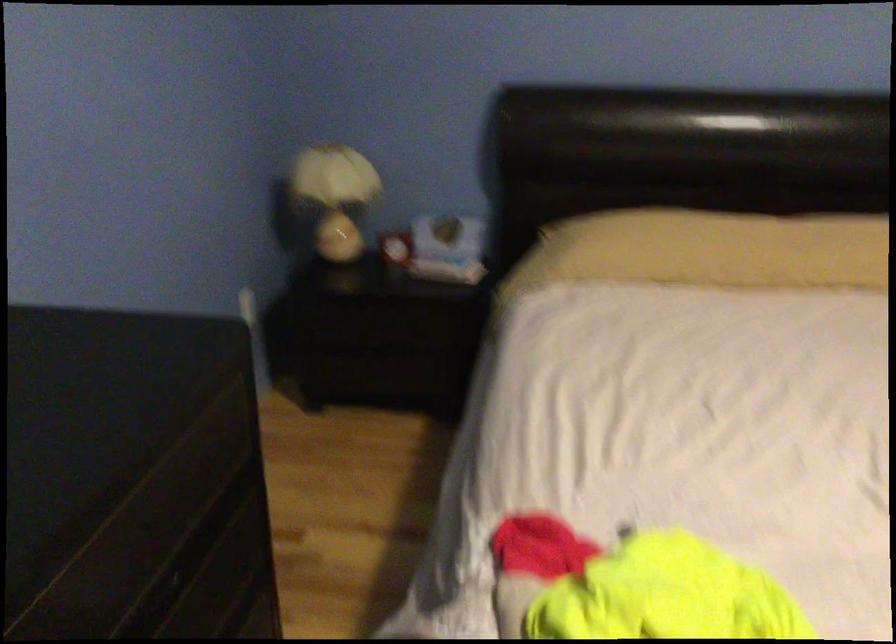
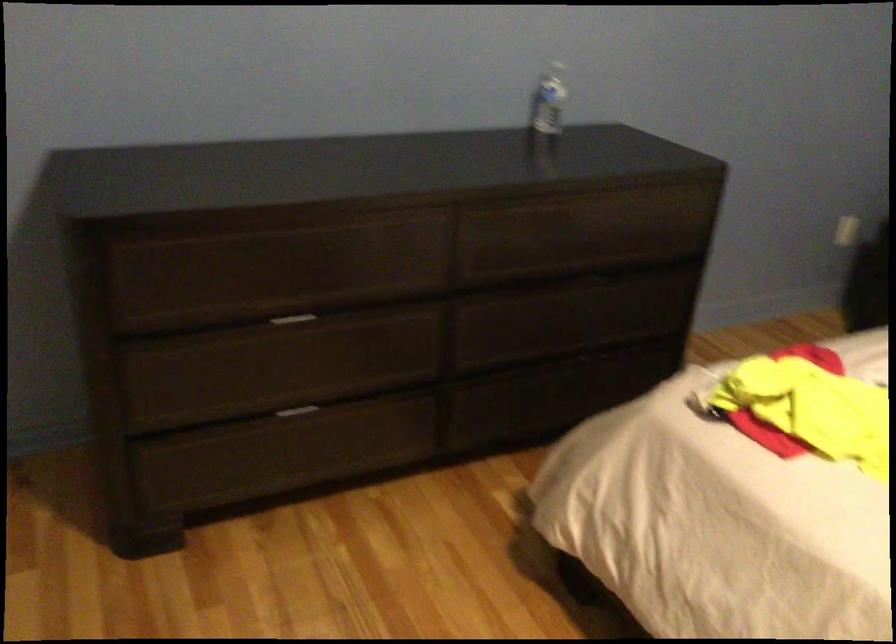
The point at (243, 328) is marked in the first image. Where is the corresponding point in the second image?

(848, 231)